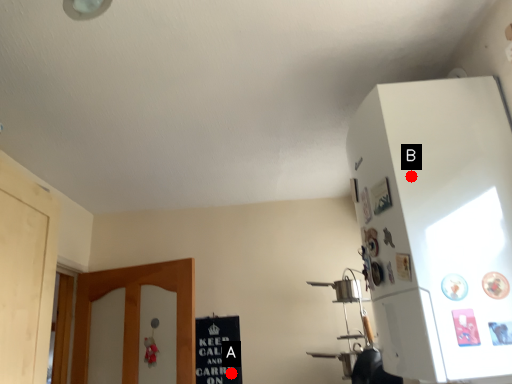
Question: Two points are circled on the image, labeled by A and B beside each circle. Among these points, which one is nearest to the camera?

Choices:
 (A) A is closer
 (B) B is closer

Answer: (B)